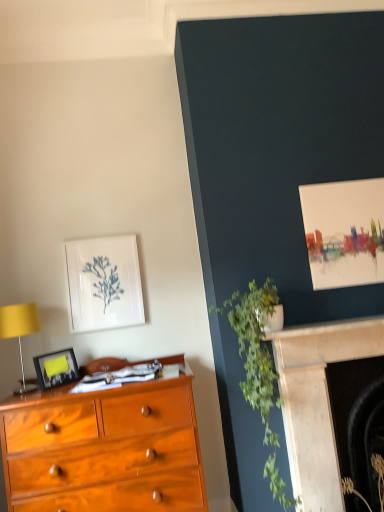
Question: Considering the positions of point (76, 361) and point (253, 388), is point (76, 361) closer or farther from the camera than point (253, 388)?

Choices:
 (A) closer
 (B) farther

Answer: (B)

Question: Is matte black picture frame at left, the first picture frame positioned from the front, wider or thinner than green leafy plant at upper right, which is counted as the 2th plant, starting from the right?

Choices:
 (A) thin
 (B) wide

Answer: (A)

Question: Considering the real-world distances, which object is farthest from the marble fireplace at lower right, placed as the 1th fireplace when sorted from front to back?

Choices:
 (A) matte black picture frame at left, which is counted as the first picture frame, starting from the bottom
 (B) marble fireplace at lower right, the first fireplace in the back-to-front sequence
 (C) white matte picture frame at upper left, the second picture frame when ordered from front to back
 (D) green leafy plant at lower right, which appears as the second plant when viewed from the left
 (E) green leafy plant at upper right, which is the 1th plant in left-to-right order

Answer: (A)

Question: Which of these objects is positioned farthest from the marble fireplace at lower right, the 2th fireplace in the back-to-front sequence?

Choices:
 (A) matte black picture frame at left, marked as the 2th picture frame in a top-to-bottom arrangement
 (B) matte yellow lampshade at left
 (C) green leafy plant at lower right, the first plant viewed from the right
 (D) marble fireplace at lower right, which is the 2th fireplace from front to back
 (E) white matte picture frame at upper left, which is the 2th picture frame in bottom-to-top order

Answer: (B)